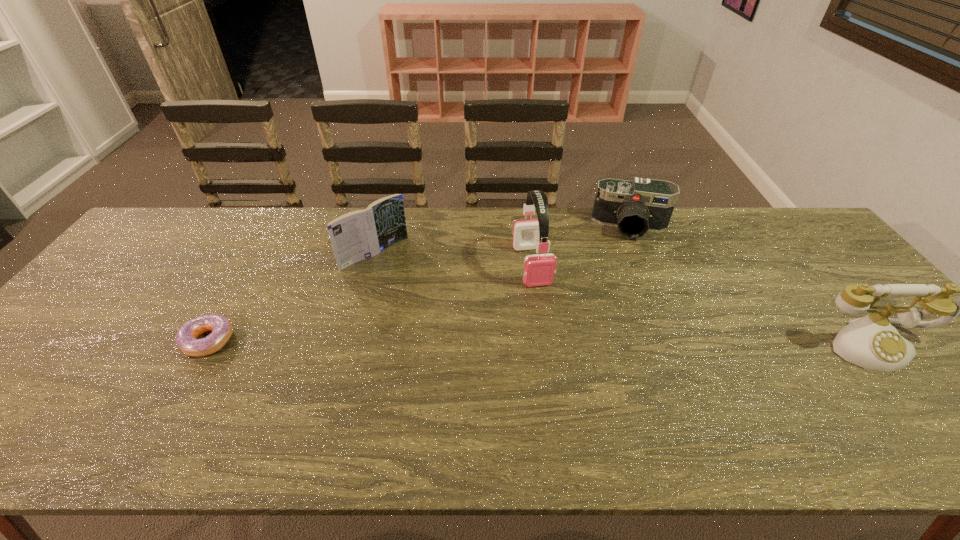
I want to click on earphone that is at the far edge, so click(539, 269).

You are a GUI agent. You are given a task and a screenshot of the screen. Output one action in this format:
    pyautogui.click(x=<x>, y=<y>)
    Task: Click on the camera at the far edge
    
    Given the screenshot: What is the action you would take?
    pyautogui.click(x=641, y=205)

This screenshot has height=540, width=960. Find the location of `object present at the right edge`. object present at the right edge is located at coordinates (872, 342).

The width and height of the screenshot is (960, 540). What are the coordinates of `vacant space at the far edge` in the screenshot? It's located at (239, 215).

In the image, there is a desktop. Identify the location of free space at the near edge. (540, 389).

This screenshot has height=540, width=960. What are the coordinates of `vacant space at the left edge` in the screenshot? It's located at (108, 287).

Image resolution: width=960 pixels, height=540 pixels. In the image, there is a desktop. What are the coordinates of `vacant space at the far left corner` in the screenshot? It's located at (151, 249).

The height and width of the screenshot is (540, 960). In order to click on unoccupied area between the second object from right to left and the rightmost object in this screenshot , I will do pos(752,286).

Identify the location of unoccupied area between the second object from left to right and the fourth tallest object. (503, 240).

The height and width of the screenshot is (540, 960). I want to click on empty space between the third object from left to right and the leftmost object, so click(x=371, y=303).